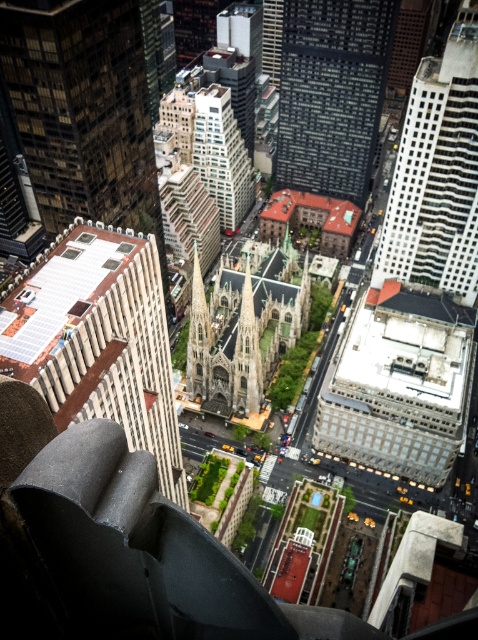
You are a drone operator tasked with flying a drone from the glassy reflective skyscraper at upper right to the golden stone spire at center. The drone has a maximum flight range of 400 feet. Can the drone successfully complete this mission without needing to recharge?

The glassy reflective skyscraper at upper right and golden stone spire at center are 419.40 feet apart from each other. Since the distance exceeds the drone s maximum flight range of 400 feet, the drone cannot complete the mission without recharging.

You are a city planner reviewing this urban layout. You need to decide which structure occupies more space in the image. Which is larger between the glassy reflective skyscraper at upper right and the green stone spire at center?

The glassy reflective skyscraper at upper right is bigger than the green stone spire at center, so it occupies more space in the image.

You are an urban planner reviewing this cityscape. You need to determine which of the two landmarks, the white textured building at center or the golden stone spire at center, requires more space for maintenance equipment. Based on their sizes, which would need more space?

The white textured building at center is larger in size than the golden stone spire at center, so it would require more space for maintenance equipment.